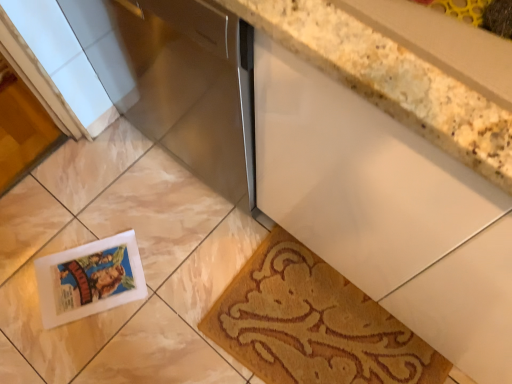
Question: Is point (366, 36) positioned closer to the camera than point (70, 321)?

Choices:
 (A) closer
 (B) farther

Answer: (A)

Question: In the image, is white granite countertop at upper right positioned in front of or behind white glossy postcard at lower left?

Choices:
 (A) behind
 (B) front

Answer: (B)

Question: Which is nearer to the satin silver dishwasher at center?

Choices:
 (A) brown textured mat at lower right
 (B) white glossy postcard at lower left
 (C) white granite countertop at upper right

Answer: (C)

Question: Which object is the farthest from the brown textured mat at lower right?

Choices:
 (A) white glossy postcard at lower left
 (B) satin silver dishwasher at center
 (C) white granite countertop at upper right

Answer: (C)